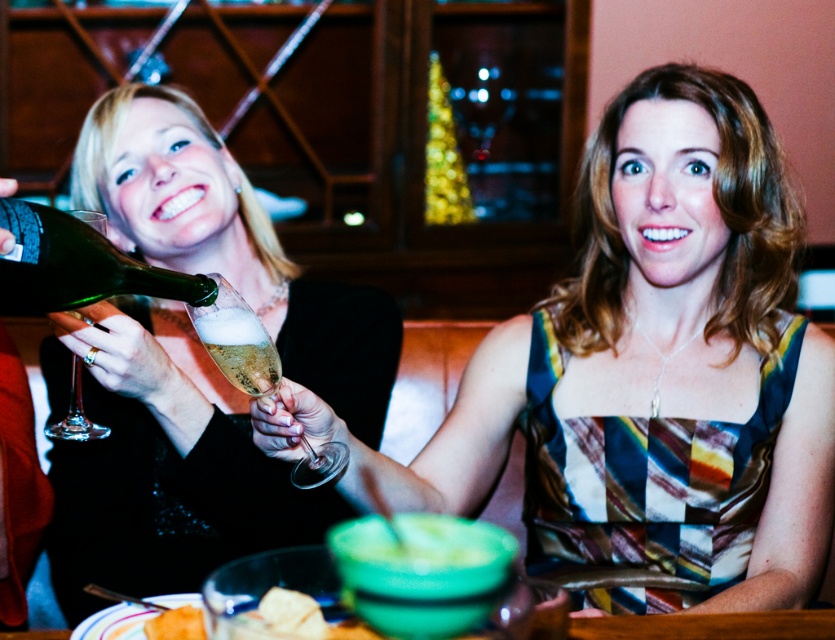
You are a photographer at the event and need to capture a clear shot of both the shiny black dress at left and the green glass bottle at left. Based on their positions, which object is closer to the camera?

The shiny black dress at left is closer to the camera because the green glass bottle at left is behind it.

You are a photographer at the event and want to capture a photo of the multicolored fabric dress at center without any obstructions. Is the green glass bottle at left blocking the view of the dress?

The multicolored fabric dress at center is positioned under the green glass bottle at left, so the bottle is blocking the view of the dress.

You are a photographer at the event and need to adjust the lighting to highlight the shiny black dress at left. Since the dress is black, you know it requires more light. Where should you position the light source relative to the point marked at coordinates point (x=162, y=465) to best illuminate the dress?

To best illuminate the shiny black dress at left, position the light source directly in front of the point marked at coordinates point (x=162, y=465) so that the light reflects off the dress and makes it visible.